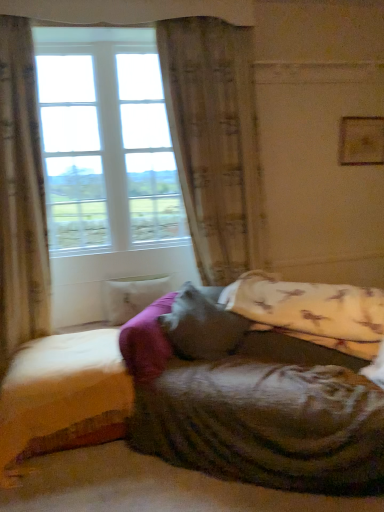
Question: Which direction should I rotate to look at white marble pillow at center, the first pillow when ordered from back to front?

Choices:
 (A) left
 (B) right

Answer: (A)

Question: Does white marble pillow at center, placed as the second pillow when sorted from right to left, have a lesser height compared to clear glass window at upper left?

Choices:
 (A) yes
 (B) no

Answer: (A)

Question: Is white marble pillow at center, the 1th pillow positioned from the left, not near clear glass window at upper left?

Choices:
 (A) no
 (B) yes

Answer: (A)

Question: Considering the relative positions of white marble pillow at center, placed as the second pillow when sorted from right to left, and clear glass window at upper left in the image provided, is white marble pillow at center, placed as the second pillow when sorted from right to left, to the right of clear glass window at upper left from the viewer's perspective?

Choices:
 (A) no
 (B) yes

Answer: (B)

Question: Is white marble pillow at center, the 1th pillow positioned from the left, located outside clear glass window at upper left?

Choices:
 (A) yes
 (B) no

Answer: (A)

Question: Is white marble pillow at center, placed as the second pillow when sorted from right to left, positioned with its back to clear glass window at upper left?

Choices:
 (A) no
 (B) yes

Answer: (A)

Question: Does white marble pillow at center, placed as the second pillow when sorted from right to left, have a larger size compared to clear glass window at upper left?

Choices:
 (A) no
 (B) yes

Answer: (A)

Question: Can you confirm if velvety gray pillow at center, which appears as the 2th pillow when viewed from the back, is thinner than white marble pillow at center, placed as the second pillow when sorted from right to left?

Choices:
 (A) yes
 (B) no

Answer: (B)

Question: Is velvety gray pillow at center, which appears as the 2th pillow when viewed from the back, closer to camera compared to white marble pillow at center, the 1th pillow positioned from the left?

Choices:
 (A) no
 (B) yes

Answer: (B)

Question: Is velvety gray pillow at center, which is the 2th pillow in left-to-right order, to the left of white marble pillow at center, the first pillow when ordered from back to front, from the viewer's perspective?

Choices:
 (A) yes
 (B) no

Answer: (B)

Question: Is velvety gray pillow at center, the 1th pillow from the front, further to the viewer compared to white marble pillow at center, which is counted as the second pillow, starting from the front?

Choices:
 (A) yes
 (B) no

Answer: (B)

Question: Is velvety gray pillow at center, which is the 2th pillow in left-to-right order, located outside white marble pillow at center, which is counted as the second pillow, starting from the front?

Choices:
 (A) no
 (B) yes

Answer: (B)

Question: Considering the relative sizes of velvety gray pillow at center, which is the 2th pillow in left-to-right order, and white marble pillow at center, the first pillow when ordered from back to front, in the image provided, is velvety gray pillow at center, which is the 2th pillow in left-to-right order, shorter than white marble pillow at center, the first pillow when ordered from back to front,?

Choices:
 (A) no
 (B) yes

Answer: (A)

Question: Is beige textured curtain at center, marked as the 1th curtain in a right-to-left arrangement, to the left of wooden bed frame at lower left from the viewer's perspective?

Choices:
 (A) no
 (B) yes

Answer: (A)